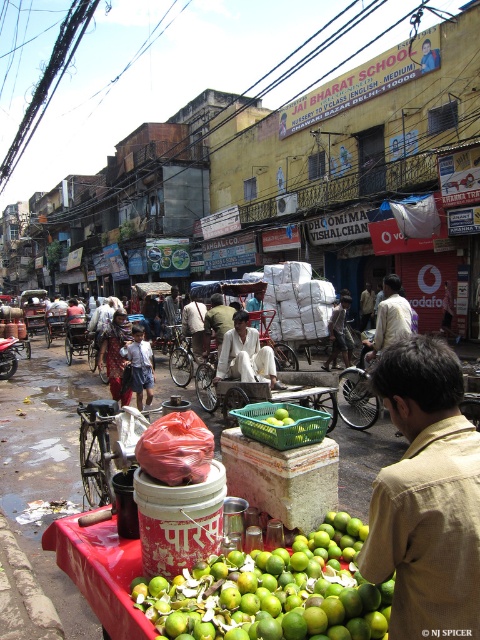
Which is in front, point (300, 433) or point (324, 410)?

Positioned in front is point (300, 433).

Who is positioned more to the left, green plastic crate at center or green plastic basket at center?

Positioned to the left is green plastic crate at center.

The height and width of the screenshot is (640, 480). Identify the location of green plastic crate at center. (282, 426).

Identify the location of green plastic crate at center. This screenshot has width=480, height=640. (282, 426).

Is point (250, 428) farther from camera compared to point (91, 349)?

No, it is not.

What do you see at coordinates (282, 426) in the screenshot? The width and height of the screenshot is (480, 640). I see `green plastic crate at center` at bounding box center [282, 426].

Does point (260, 408) come in front of point (79, 323)?

Yes, point (260, 408) is in front of point (79, 323).

Locate an element on the screen. The width and height of the screenshot is (480, 640). green plastic crate at center is located at coordinates (282, 426).

Can you confirm if brown cotton shirt at center is wider than plastic red cart at center?

In fact, brown cotton shirt at center might be narrower than plastic red cart at center.

Does brown cotton shirt at center appear under plastic red cart at center?

No, brown cotton shirt at center is not below plastic red cart at center.

Find the location of a particular element. This screenshot has height=640, width=480. brown cotton shirt at center is located at coordinates (427, 497).

Where is `brown cotton shirt at center`? This screenshot has height=640, width=480. brown cotton shirt at center is located at coordinates (427, 497).